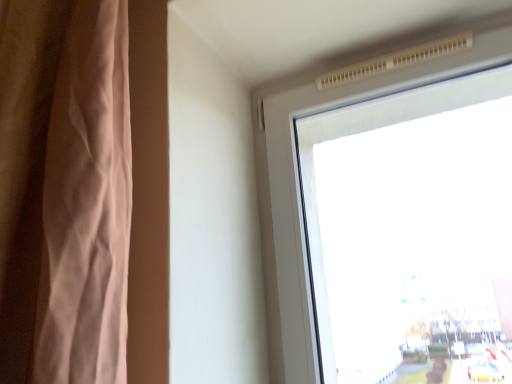
Measure the distance between point (40,258) and camera.

The distance of point (40,258) from camera is 20.63 inches.

The width and height of the screenshot is (512, 384). What do you see at coordinates (64, 190) in the screenshot?
I see `brown fabric curtain at left` at bounding box center [64, 190].

Locate an element on the screen. Image resolution: width=512 pixels, height=384 pixels. brown fabric curtain at left is located at coordinates (64, 190).

Where is `brown fabric curtain at left`? brown fabric curtain at left is located at coordinates (64, 190).